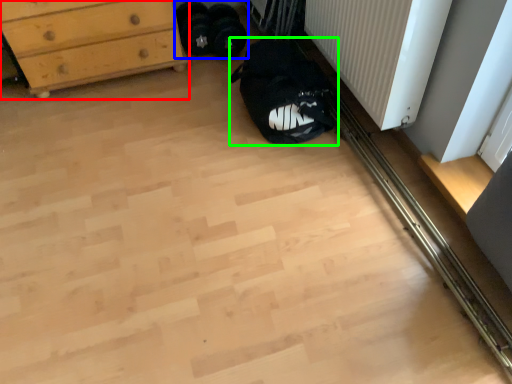
Question: Considering the real-world distances, which object is closest to chest of drawers (highlighted by a red box)? footwear (highlighted by a blue box) or sleeping bag (highlighted by a green box).

Choices:
 (A) footwear
 (B) sleeping bag

Answer: (A)